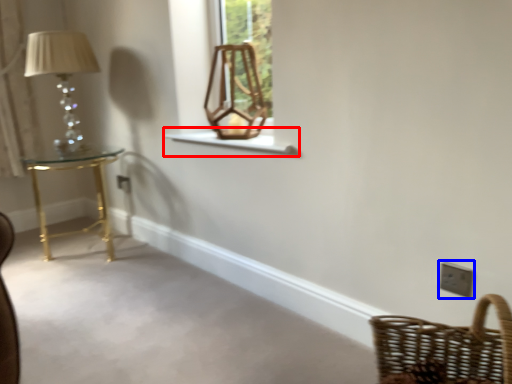
Question: Which of the following is the farthest to the observer, window sill (highlighted by a red box) or light switch (highlighted by a blue box)?

Choices:
 (A) window sill
 (B) light switch

Answer: (A)